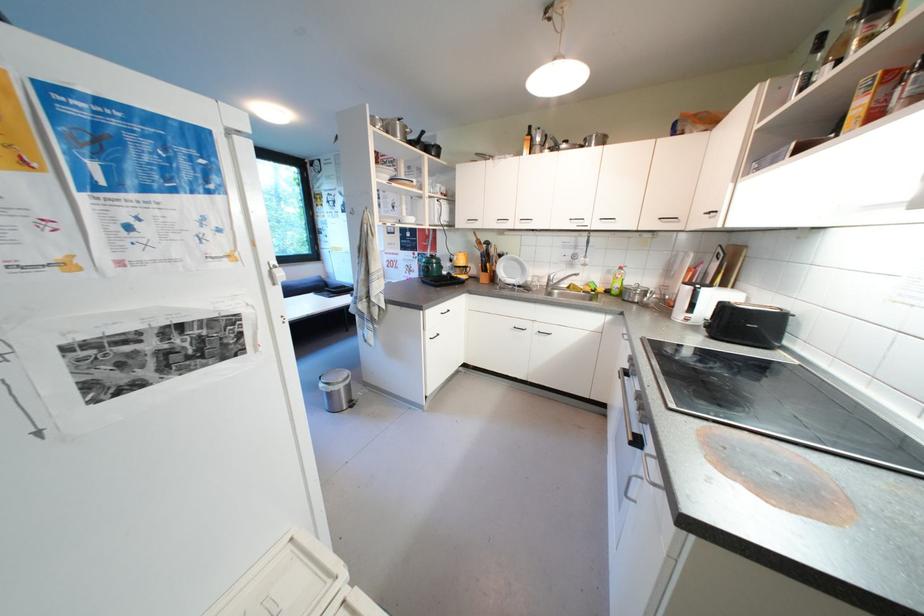
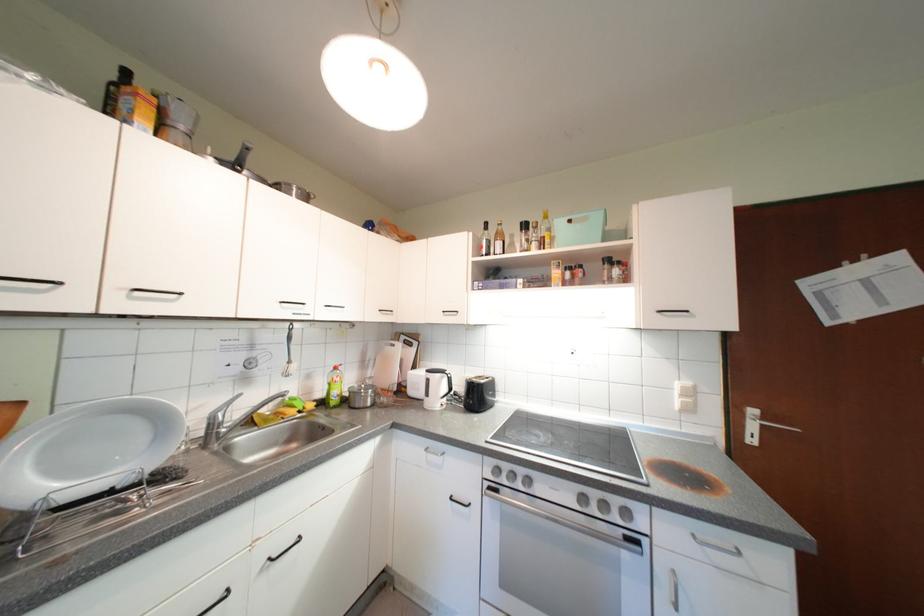
The point at (556, 278) is marked in the first image. Where is the corresponding point in the second image?

(220, 419)